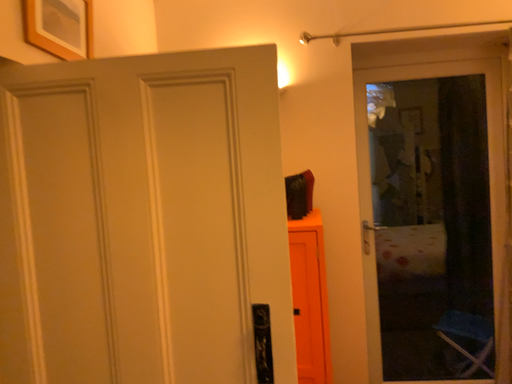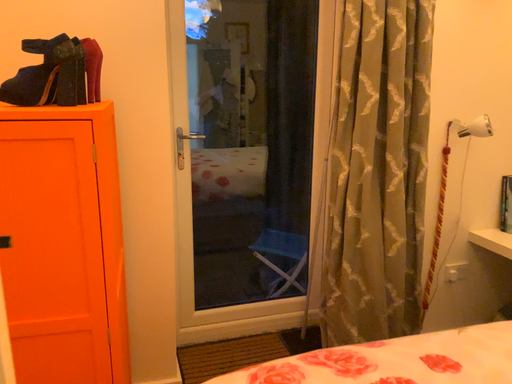
Question: Which way did the camera rotate in the video?

Choices:
 (A) rotated downward
 (B) rotated upward

Answer: (A)